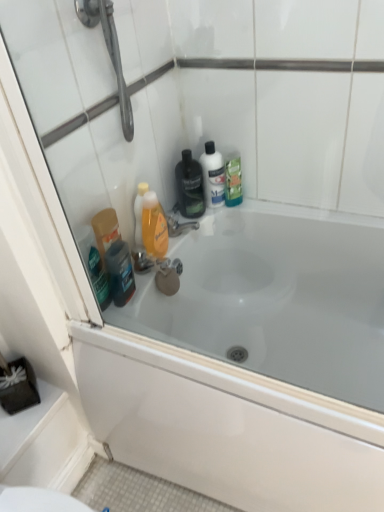
You are a GUI agent. You are given a task and a screenshot of the screen. Output one action in this format:
    pyautogui.click(x=<x>, y=<y>)
    Task: Click on the white glossy bathtub at upper center
    
    Given the screenshot: What is the action you would take?
    pyautogui.click(x=251, y=362)

The width and height of the screenshot is (384, 512). What do you see at coordinates (179, 226) in the screenshot?
I see `metallic chrome faucet at center` at bounding box center [179, 226].

This screenshot has height=512, width=384. Find the location of `metallic chrome faucet at center`. metallic chrome faucet at center is located at coordinates (179, 226).

Locate an element on the screen. translucent orange liquid at center, the first mouthwash from the left is located at coordinates (154, 226).

The height and width of the screenshot is (512, 384). What are the coordinates of `shiny dark blue bottle at lower left` in the screenshot? It's located at (120, 272).

Locate an element on the screen. The width and height of the screenshot is (384, 512). white glossy bathtub at upper center is located at coordinates (251, 362).

Considering the relative sizes of metallic chrome faucet at center and translucent orange liquid at center, which is the fourth mouthwash from right to left, in the image provided, is metallic chrome faucet at center smaller than translucent orange liquid at center, which is the fourth mouthwash from right to left,?

Yes.

From the image's perspective, which is below, metallic chrome faucet at center or translucent orange liquid at center, the first mouthwash from the left?

translucent orange liquid at center, the first mouthwash from the left, is shown below in the image.

How different are the orientations of metallic chrome faucet at center and translucent orange liquid at center, which is the fourth mouthwash from right to left, in degrees?

There is a 0.000572-degree angle between the facing directions of metallic chrome faucet at center and translucent orange liquid at center, which is the fourth mouthwash from right to left.

From a real-world perspective, is white glossy mouthwash at center, arranged as the 2th mouthwash when viewed from the right, above or below translucent plastic mouthwash at upper right, the 1th mouthwash from the right?

From a real-world perspective, white glossy mouthwash at center, arranged as the 2th mouthwash when viewed from the right, is physically above translucent plastic mouthwash at upper right, the 1th mouthwash from the right.

Does point (205, 168) come in front of point (225, 168)?

Yes, point (205, 168) is in front of point (225, 168).

From the image's perspective, which is above, white glossy mouthwash at center, arranged as the 2th mouthwash when viewed from the right, or translucent plastic mouthwash at upper right, the 1th mouthwash from the right?

white glossy mouthwash at center, arranged as the 2th mouthwash when viewed from the right, is shown above in the image.

Are white glossy mouthwash at center, the 3th mouthwash when ordered from left to right, and translucent plastic mouthwash at upper right, which is counted as the 4th mouthwash, starting from the left, making contact?

Yes, white glossy mouthwash at center, the 3th mouthwash when ordered from left to right, is with translucent plastic mouthwash at upper right, which is counted as the 4th mouthwash, starting from the left.

From the image's perspective, would you say translucent plastic mouthwash at upper right, which is counted as the 4th mouthwash, starting from the left, is positioned over shiny dark blue bottle at lower left?

Answer: Yes, from the image's perspective, translucent plastic mouthwash at upper right, which is counted as the 4th mouthwash, starting from the left, is on top of shiny dark blue bottle at lower left.

Is translucent plastic mouthwash at upper right, the 1th mouthwash from the right, facing towards shiny dark blue bottle at lower left?

No, translucent plastic mouthwash at upper right, the 1th mouthwash from the right, does not turn towards shiny dark blue bottle at lower left.

Looking at their sizes, would you say translucent plastic mouthwash at upper right, which is counted as the 4th mouthwash, starting from the left, is wider or thinner than shiny dark blue bottle at lower left?

translucent plastic mouthwash at upper right, which is counted as the 4th mouthwash, starting from the left, is wider than shiny dark blue bottle at lower left.

Are white glossy bathtub at upper center and metallic chrome faucet at center located far from each other?

No, white glossy bathtub at upper center is not far away from metallic chrome faucet at center.

From the image's perspective, is white glossy bathtub at upper center located above or below metallic chrome faucet at center?

white glossy bathtub at upper center is situated lower than metallic chrome faucet at center in the image.

Is point (195, 462) in front of point (186, 228)?

Yes, it is.

Can you tell me how much white glossy bathtub at upper center and metallic chrome faucet at center differ in facing direction?

They differ by 88 degrees in their facing directions.

Does point (199, 212) come farther from viewer compared to point (221, 161)?

No.

Is black glossy mouthwash at center, acting as the third mouthwash starting from the right, at the left side of white glossy mouthwash at center, the 3th mouthwash when ordered from left to right?

Yes, black glossy mouthwash at center, acting as the third mouthwash starting from the right, is to the left of white glossy mouthwash at center, the 3th mouthwash when ordered from left to right.

Would you say black glossy mouthwash at center, which is counted as the 2th mouthwash, starting from the left, is outside white glossy mouthwash at center, the 3th mouthwash when ordered from left to right?

Yes.

From the image's perspective, does black glossy mouthwash at center, acting as the third mouthwash starting from the right, appear higher than white glossy mouthwash at center, the 3th mouthwash when ordered from left to right?

Actually, black glossy mouthwash at center, acting as the third mouthwash starting from the right, appears below white glossy mouthwash at center, the 3th mouthwash when ordered from left to right, in the image.

Can white glossy bathtub at upper center be found inside black glossy mouthwash at center, which is counted as the 2th mouthwash, starting from the left?

No, white glossy bathtub at upper center is not surrounded by black glossy mouthwash at center, which is counted as the 2th mouthwash, starting from the left.

Which is farther, (201, 188) or (220, 358)?

Point (220, 358)

Find the location of a particular element. Image resolution: width=384 pixels, height=512 pixels. the 2nd mouthwash behind the white glossy bathtub at upper center, starting your count from the anchor is located at coordinates (189, 186).

Does black glossy mouthwash at center, which is counted as the 2th mouthwash, starting from the left, have a smaller size compared to white glossy bathtub at upper center?

Correct, black glossy mouthwash at center, which is counted as the 2th mouthwash, starting from the left, occupies less space than white glossy bathtub at upper center.

Is translucent plastic mouthwash at upper right, which is counted as the 4th mouthwash, starting from the left, looking in the opposite direction of black glossy mouthwash at center, which is counted as the 2th mouthwash, starting from the left?

No, translucent plastic mouthwash at upper right, which is counted as the 4th mouthwash, starting from the left, is not facing away from black glossy mouthwash at center, which is counted as the 2th mouthwash, starting from the left.

Can black glossy mouthwash at center, which is counted as the 2th mouthwash, starting from the left, be found inside translucent plastic mouthwash at upper right, the 1th mouthwash from the right?

No, black glossy mouthwash at center, which is counted as the 2th mouthwash, starting from the left, is not a part of translucent plastic mouthwash at upper right, the 1th mouthwash from the right.

Considering the relative sizes of translucent plastic mouthwash at upper right, which is counted as the 4th mouthwash, starting from the left, and black glossy mouthwash at center, which is counted as the 2th mouthwash, starting from the left, in the image provided, is translucent plastic mouthwash at upper right, which is counted as the 4th mouthwash, starting from the left, taller than black glossy mouthwash at center, which is counted as the 2th mouthwash, starting from the left,?

No, translucent plastic mouthwash at upper right, which is counted as the 4th mouthwash, starting from the left, is not taller than black glossy mouthwash at center, which is counted as the 2th mouthwash, starting from the left.

Where is `tap behind the translucent orange liquid at center, the first mouthwash from the left`? The width and height of the screenshot is (384, 512). tap behind the translucent orange liquid at center, the first mouthwash from the left is located at coordinates (179, 226).

Where is `the 1st mouthwash below when counting from the white glossy mouthwash at center, arranged as the 2th mouthwash when viewed from the right (from the image's perspective)`? the 1st mouthwash below when counting from the white glossy mouthwash at center, arranged as the 2th mouthwash when viewed from the right (from the image's perspective) is located at coordinates (233, 180).

Based on their spatial positions, is white glossy mouthwash at center, arranged as the 2th mouthwash when viewed from the right, or translucent plastic mouthwash at upper right, the 1th mouthwash from the right, further from white glossy bathtub at upper center?

translucent plastic mouthwash at upper right, the 1th mouthwash from the right.

Estimate the real-world distances between objects in this image. Which object is closer to white glossy bathtub at upper center, metallic chrome faucet at center or translucent orange liquid at center, which is the fourth mouthwash from right to left?

The object closer to white glossy bathtub at upper center is translucent orange liquid at center, which is the fourth mouthwash from right to left.

Based on the photo, when comparing their distances from white glossy bathtub at upper center, does translucent plastic mouthwash at upper right, which is counted as the 4th mouthwash, starting from the left, or black glossy mouthwash at center, which is counted as the 2th mouthwash, starting from the left, seem further?

Based on the image, translucent plastic mouthwash at upper right, which is counted as the 4th mouthwash, starting from the left, appears to be further to white glossy bathtub at upper center.

When comparing their distances from white glossy mouthwash at center, the 3th mouthwash when ordered from left to right, does metallic chrome faucet at center or black glossy mouthwash at center, acting as the third mouthwash starting from the right, seem further?

metallic chrome faucet at center is further to white glossy mouthwash at center, the 3th mouthwash when ordered from left to right.

Based on their spatial positions, is white glossy mouthwash at center, arranged as the 2th mouthwash when viewed from the right, or black glossy mouthwash at center, which is counted as the 2th mouthwash, starting from the left, further from white glossy bathtub at upper center?

The object further to white glossy bathtub at upper center is white glossy mouthwash at center, arranged as the 2th mouthwash when viewed from the right.

Estimate the real-world distances between objects in this image. Which object is further from translucent orange liquid at center, which is the fourth mouthwash from right to left, white glossy mouthwash at center, the 3th mouthwash when ordered from left to right, or white glossy bathtub at upper center?

white glossy bathtub at upper center.

Which object lies nearer to the anchor point white glossy bathtub at upper center, black glossy mouthwash at center, which is counted as the 2th mouthwash, starting from the left, or shiny dark blue bottle at lower left?

The object closer to white glossy bathtub at upper center is shiny dark blue bottle at lower left.

Estimate the real-world distances between objects in this image. Which object is further from translucent orange liquid at center, the first mouthwash from the left, white glossy bathtub at upper center or black glossy mouthwash at center, acting as the third mouthwash starting from the right?

white glossy bathtub at upper center is positioned further to the anchor translucent orange liquid at center, the first mouthwash from the left.

Where is `tap between white glossy bathtub at upper center and white glossy mouthwash at center, arranged as the 2th mouthwash when viewed from the right, in the front-back direction`? tap between white glossy bathtub at upper center and white glossy mouthwash at center, arranged as the 2th mouthwash when viewed from the right, in the front-back direction is located at coordinates (179, 226).

What are the coordinates of `toiletry between white glossy bathtub at upper center and translucent orange liquid at center, the first mouthwash from the left, along the z-axis` in the screenshot? It's located at (120, 272).

Where is `mouthwash positioned between white glossy bathtub at upper center and black glossy mouthwash at center, acting as the third mouthwash starting from the right, from near to far`? mouthwash positioned between white glossy bathtub at upper center and black glossy mouthwash at center, acting as the third mouthwash starting from the right, from near to far is located at coordinates (154, 226).

The width and height of the screenshot is (384, 512). Find the location of `mouthwash located between black glossy mouthwash at center, which is counted as the 2th mouthwash, starting from the left, and translucent plastic mouthwash at upper right, the 1th mouthwash from the right, in the left-right direction`. mouthwash located between black glossy mouthwash at center, which is counted as the 2th mouthwash, starting from the left, and translucent plastic mouthwash at upper right, the 1th mouthwash from the right, in the left-right direction is located at coordinates (213, 175).